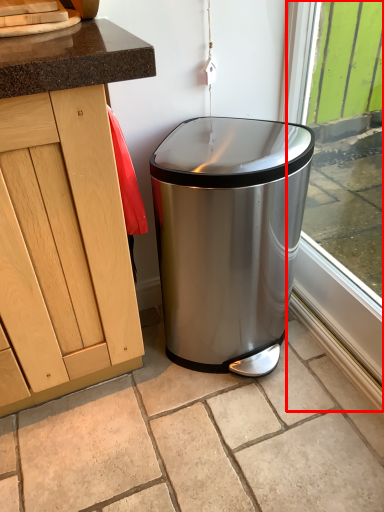
Question: From the image, what is the correct spatial relationship of window frame (annotated by the red box) in relation to waste container?

Choices:
 (A) right
 (B) left

Answer: (A)